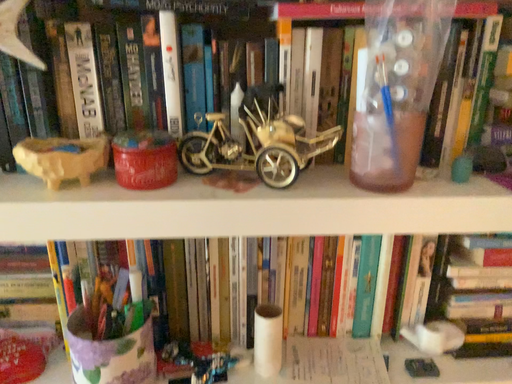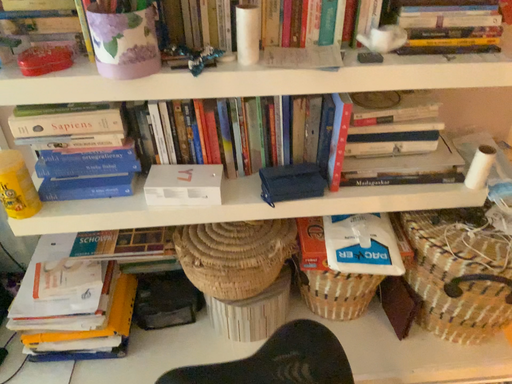
Question: How did the camera likely rotate when shooting the video?

Choices:
 (A) rotated upward
 (B) rotated downward

Answer: (B)